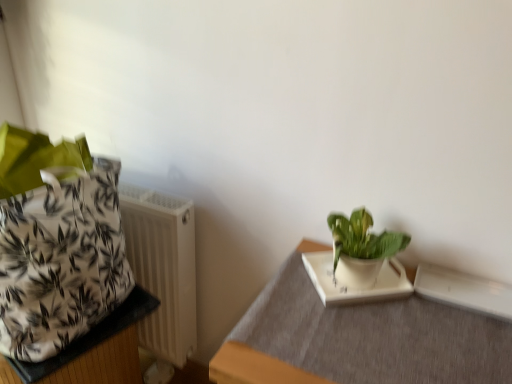
This screenshot has height=384, width=512. Identify the location of empty space that is ontop of white plastic radiator at left. (154, 198).